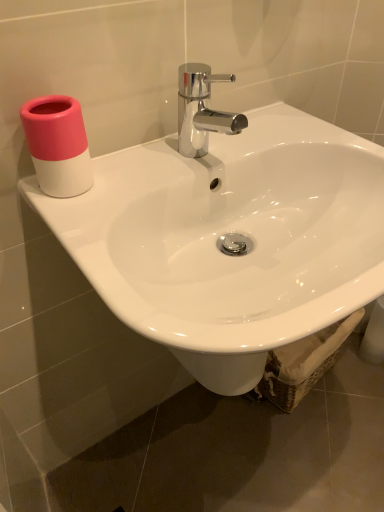
Locate an element on the screen. The height and width of the screenshot is (512, 384). free space on the front side of pink matte cup at upper left is located at coordinates (86, 221).